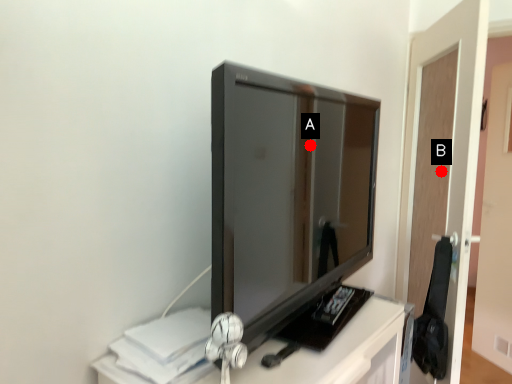
Question: Two points are circled on the image, labeled by A and B beside each circle. Which point is farther from the camera taking this photo?

Choices:
 (A) A is further
 (B) B is further

Answer: (B)